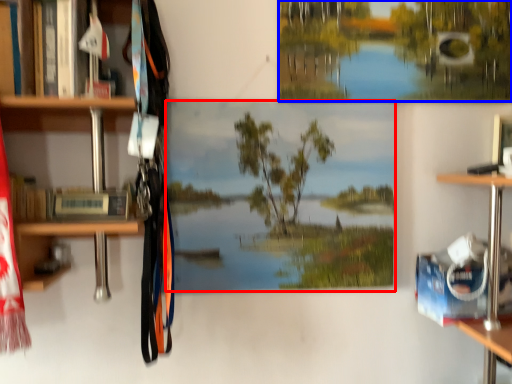
Question: Among these objects, which one is farthest to the camera, mural (highlighted by a red box) or tree (highlighted by a blue box)?

Choices:
 (A) mural
 (B) tree

Answer: (B)